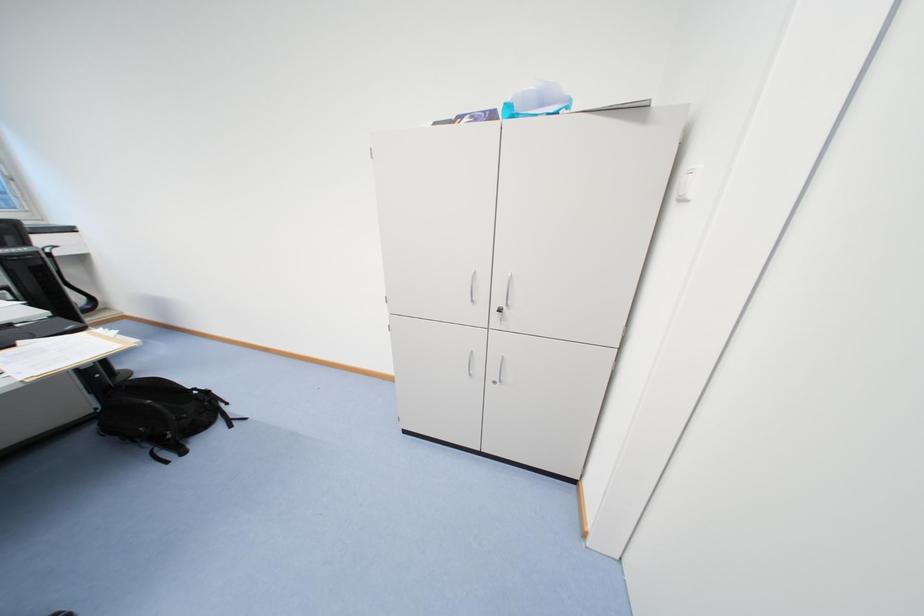
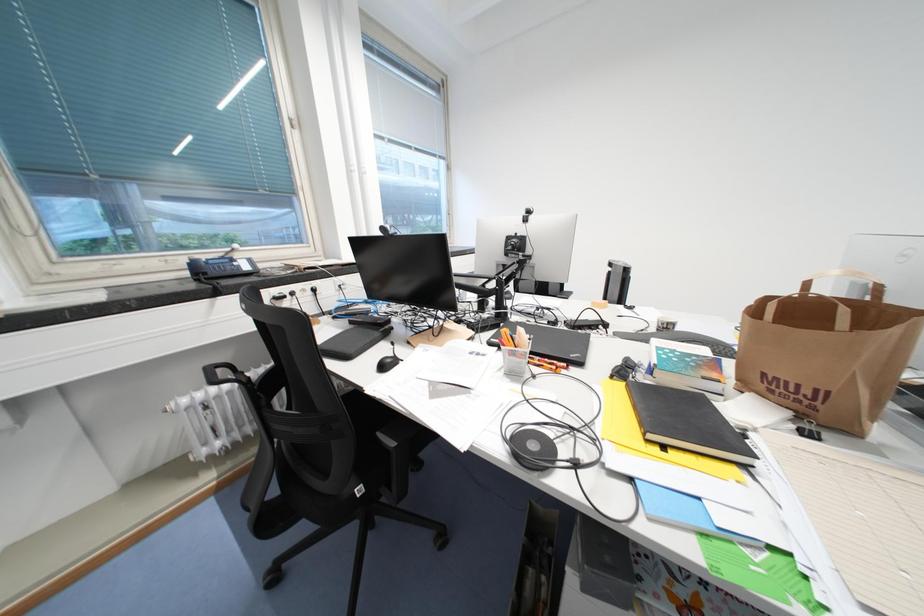
Question: Which direction would the cameraman need to move to produce the second image? Reply with the corresponding letter.

Choices:
 (A) Left
 (B) Right
 (C) Forward
 (D) Backward

Answer: (A)